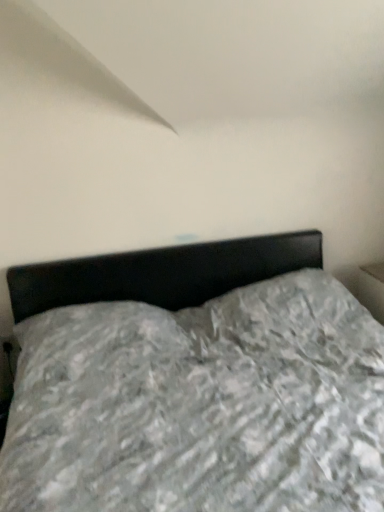
Where is `gray fabric bed at center`? This screenshot has height=512, width=384. gray fabric bed at center is located at coordinates (194, 384).

In order to face gray fabric bed at center, should I rotate leftwards or rightwards?

To align with it, rotate right about 4.359°.

Image resolution: width=384 pixels, height=512 pixels. Describe the element at coordinates (194, 384) in the screenshot. I see `gray fabric bed at center` at that location.

What is the approximate width of gray fabric bed at center?

1.73 meters.

You are a GUI agent. You are given a task and a screenshot of the screen. Output one action in this format:
    pyautogui.click(x=<x>, y=<y>)
    Task: Click on the gray fabric bed at center
    The width and height of the screenshot is (384, 512).
    Given the screenshot: What is the action you would take?
    pyautogui.click(x=194, y=384)